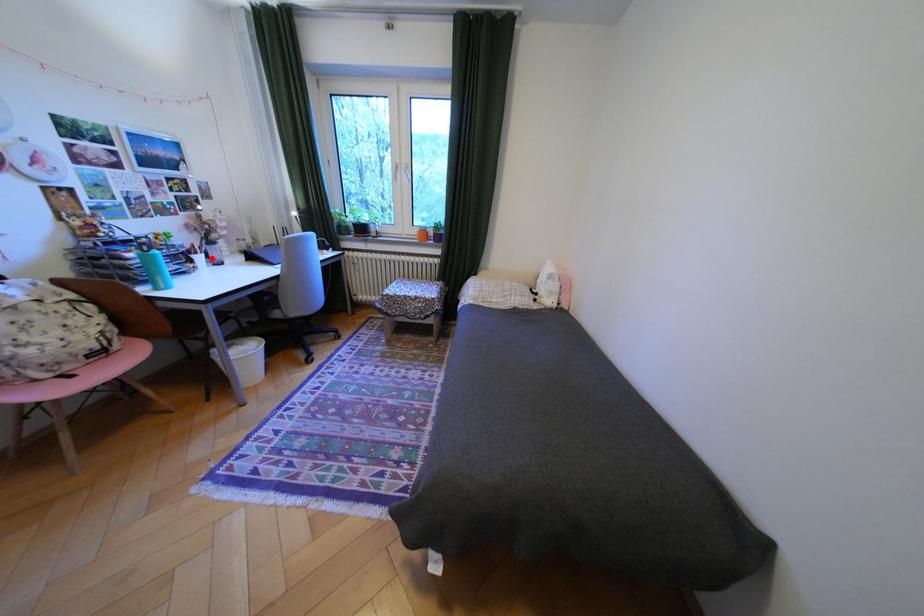
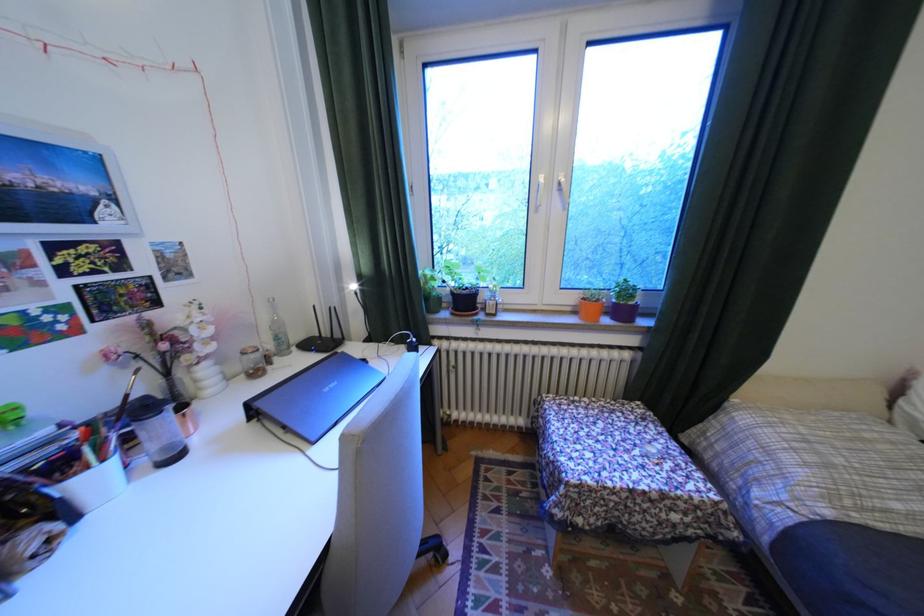
The point at the highlighted location is marked in the first image. Where is the corresponding point in the second image?

(106, 479)